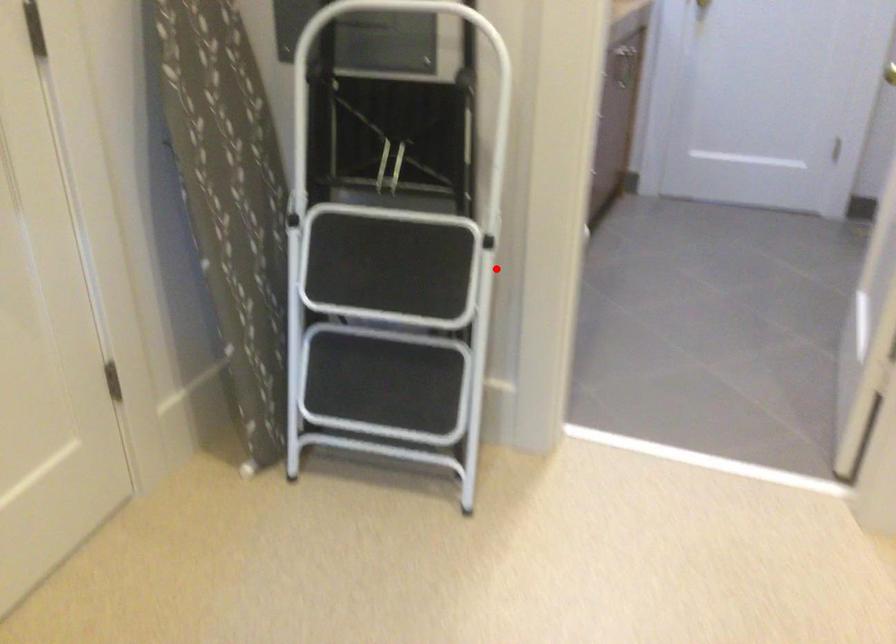
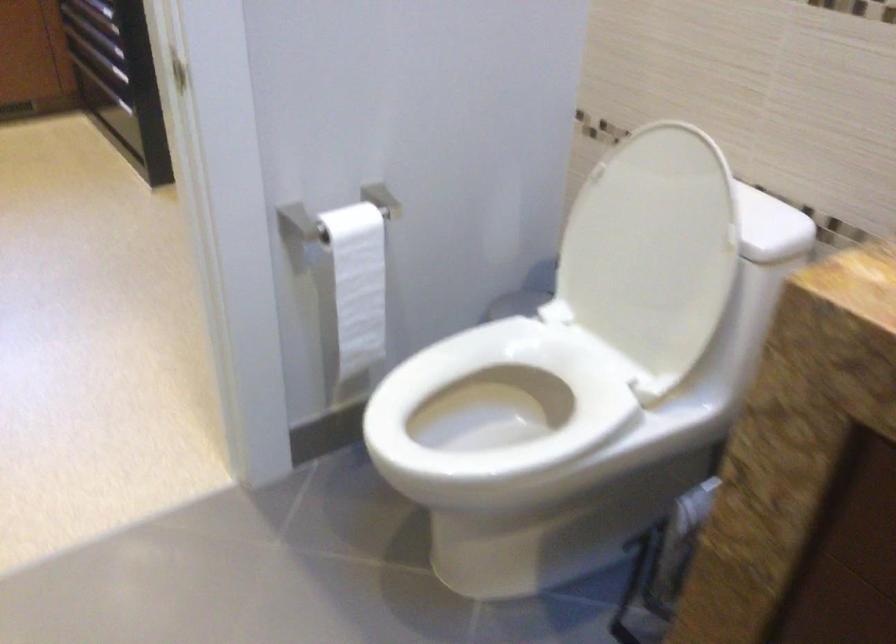
Question: I am providing you with two images of the same scene from different viewpoints. In image1, a red point is highlighted. Considering the same 3D point in image2, which of the following is correct?

Choices:
 (A) It is closer
 (B) It is farther

Answer: (A)